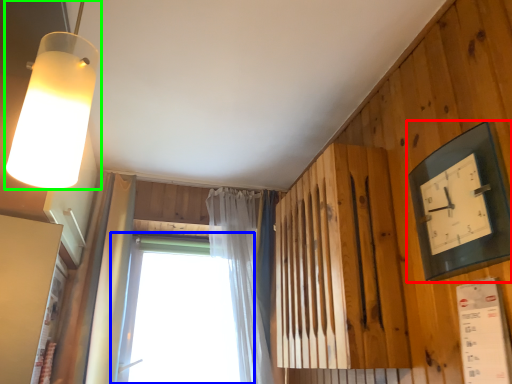
Question: Estimate the real-world distances between objects in this image. Which object is closer to clock (highlighted by a red box), window (highlighted by a blue box) or lamp (highlighted by a green box)?

Choices:
 (A) window
 (B) lamp

Answer: (B)